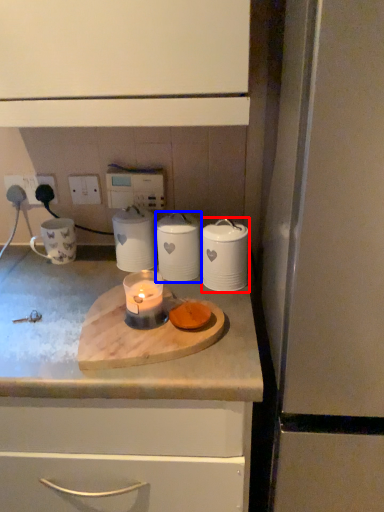
Question: Which point is further to the camera, kitchen appliance (highlighted by a red box) or kitchen appliance (highlighted by a blue box)?

Choices:
 (A) kitchen appliance
 (B) kitchen appliance

Answer: (B)